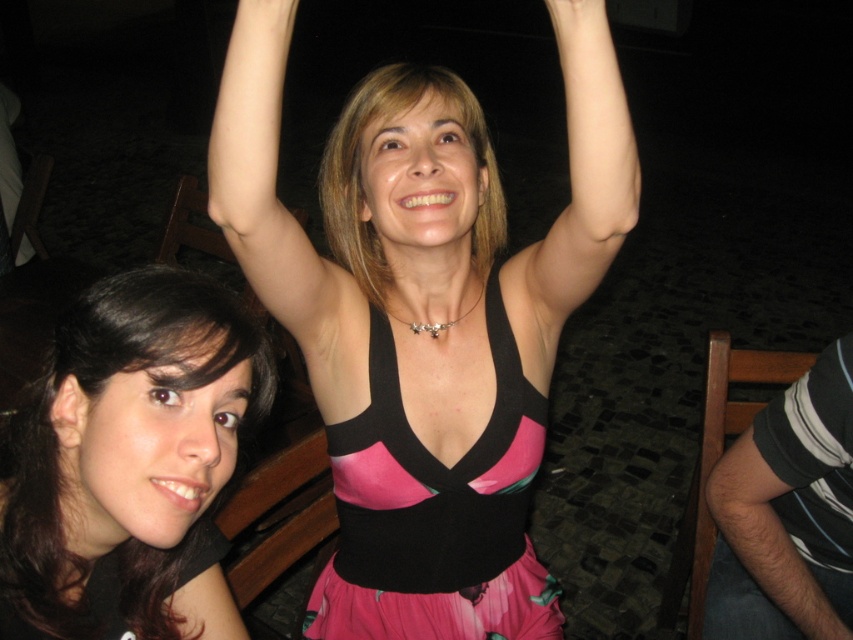
You are a photographer at a party and want to capture a photo of the black striped shirt at right and the smooth skin hand at upper center. Based on their positions, which object is closer to the camera?

The smooth skin hand at upper center is closer to the camera because it is positioned above the black striped shirt at right, which is located below it.

You are a photographer trying to capture a group photo of the two people in the scene. You need to ensure that both the pink matte dress at center and the matte black tank top at center are fully visible in the frame. Given their widths, which one requires more horizontal space to be entirely captured?

The pink matte dress at center requires more horizontal space because its width surpasses that of the matte black tank top at center.